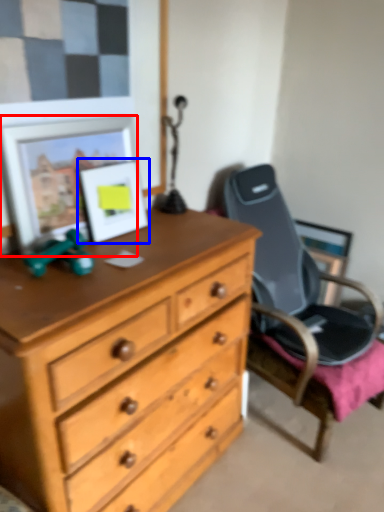
Question: Among these objects, which one is nearest to the camera, picture frame (highlighted by a red box) or picture frame (highlighted by a blue box)?

Choices:
 (A) picture frame
 (B) picture frame

Answer: (A)